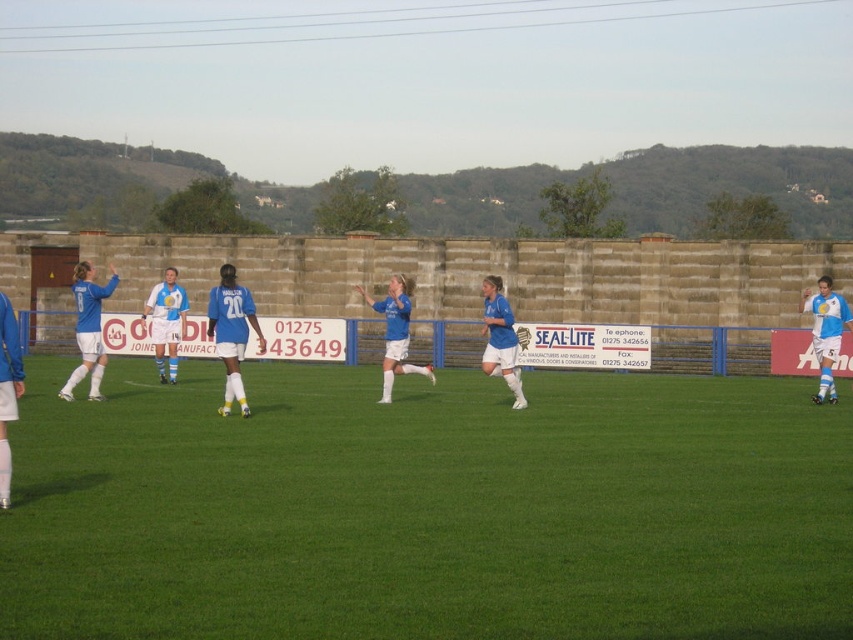
Question: Among these points, which one is nearest to the camera?

Choices:
 (A) [x=107, y=285]
 (B) [x=564, y=504]
 (C) [x=813, y=304]

Answer: (B)

Question: From the image, what is the correct spatial relationship of green grass at center in relation to white matte soccer ball at right?

Choices:
 (A) right
 (B) left

Answer: (B)

Question: Based on their relative distances, which object is nearer to the white matte soccer ball at right?

Choices:
 (A) blue matte soccer ball at left
 (B) green grass at center

Answer: (B)

Question: From the image, what is the correct spatial relationship of green grass at center in relation to white matte soccer ball at right?

Choices:
 (A) left
 (B) right

Answer: (A)

Question: Can you confirm if green grass at center is positioned to the right of blue matte soccer ball at left?

Choices:
 (A) yes
 (B) no

Answer: (A)

Question: Which of the following is the closest to the observer?

Choices:
 (A) (828, 378)
 (B) (776, 388)
 (C) (93, 291)

Answer: (C)